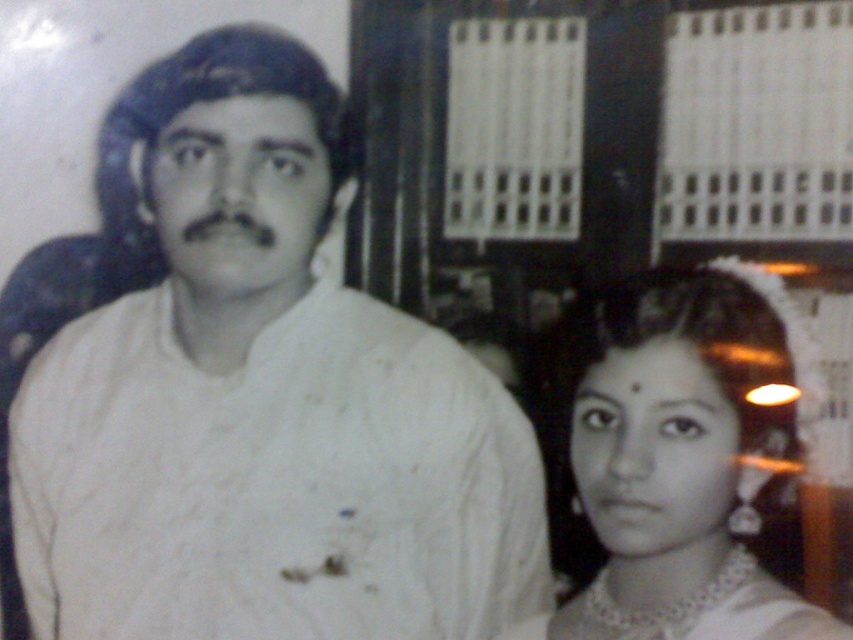
Can you confirm if white textured shirt at center is positioned to the left of pearl necklace at center?

Yes, white textured shirt at center is to the left of pearl necklace at center.

Does white textured shirt at center lie behind pearl necklace at center?

Yes, white textured shirt at center is behind pearl necklace at center.

You are a GUI agent. You are given a task and a screenshot of the screen. Output one action in this format:
    pyautogui.click(x=<x>, y=<y>)
    Task: Click on the white textured shirt at center
    Image resolution: width=853 pixels, height=640 pixels.
    Given the screenshot: What is the action you would take?
    pyautogui.click(x=258, y=397)

The width and height of the screenshot is (853, 640). In order to click on white textured shirt at center in this screenshot , I will do `click(258, 397)`.